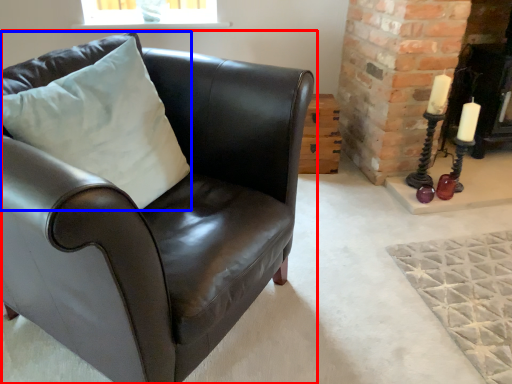
Question: Which of the following is the closest to the observer, chair (highlighted by a red box) or pillow (highlighted by a blue box)?

Choices:
 (A) chair
 (B) pillow

Answer: (A)